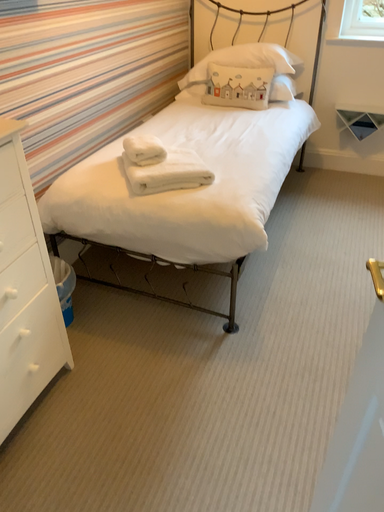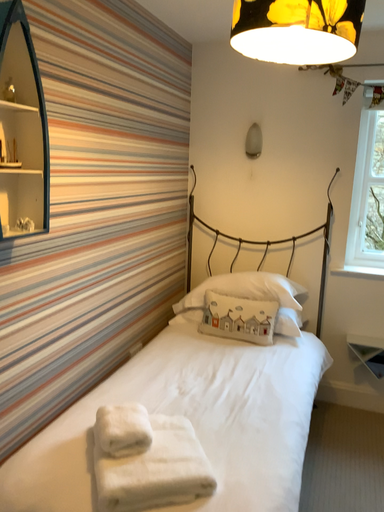
Question: Which way did the camera rotate in the video?

Choices:
 (A) rotated downward
 (B) rotated upward

Answer: (B)